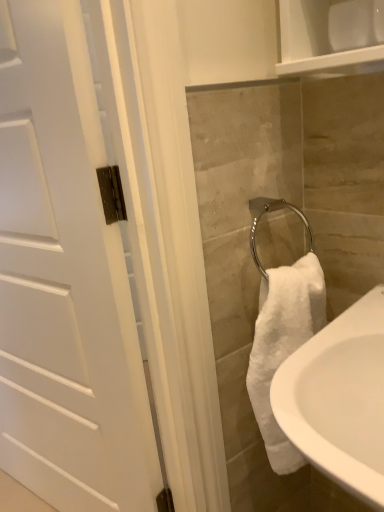
Question: Would you say white matte door at left is to the left or to the right of white ceramic sink at lower right in the picture?

Choices:
 (A) left
 (B) right

Answer: (A)

Question: Is white matte door at left spatially inside white ceramic sink at lower right, or outside of it?

Choices:
 (A) outside
 (B) inside

Answer: (A)

Question: Considering the positions of white matte door at left and white ceramic sink at lower right in the image, is white matte door at left wider or thinner than white ceramic sink at lower right?

Choices:
 (A) thin
 (B) wide

Answer: (A)

Question: Is white ceramic sink at lower right in front of or behind white matte door at left in the image?

Choices:
 (A) front
 (B) behind

Answer: (A)

Question: From a real-world perspective, is white ceramic sink at lower right above or below white matte door at left?

Choices:
 (A) below
 (B) above

Answer: (A)

Question: In terms of height, does white ceramic sink at lower right look taller or shorter compared to white matte door at left?

Choices:
 (A) short
 (B) tall

Answer: (A)

Question: Based on their positions, is white ceramic sink at lower right located to the left or right of white matte door at left?

Choices:
 (A) left
 (B) right

Answer: (B)